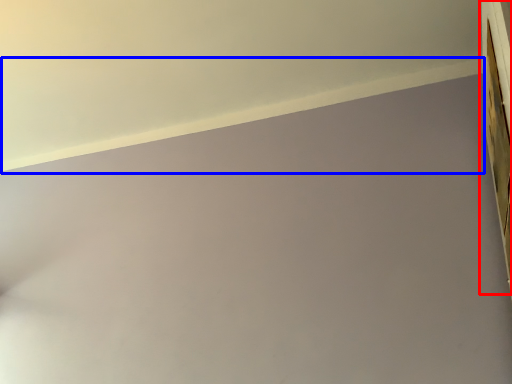
Question: Which of the following is the farthest to the observer, window frame (highlighted by a red box) or window sill (highlighted by a blue box)?

Choices:
 (A) window frame
 (B) window sill

Answer: (A)